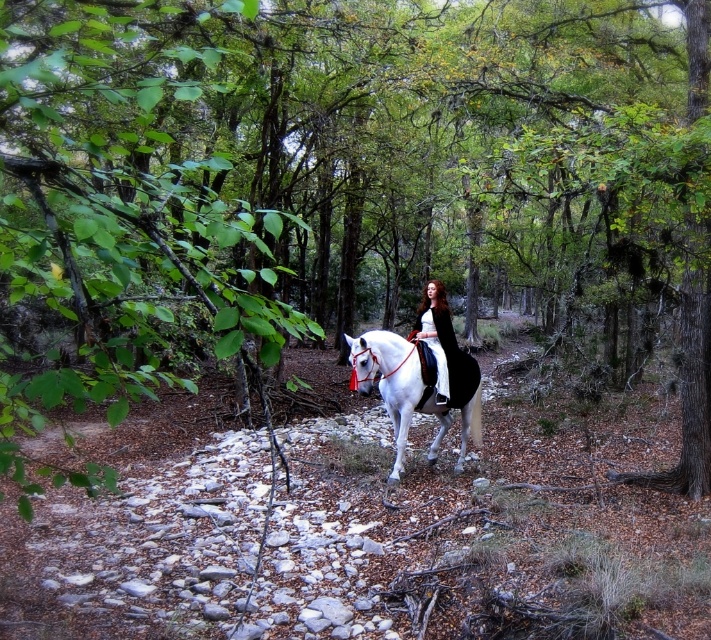
Is white glossy horse at center positioned in front of velvet black coat at center?

Yes, white glossy horse at center is in front of velvet black coat at center.

Who is lower down, white glossy horse at center or velvet black coat at center?

Positioned lower is white glossy horse at center.

The image size is (711, 640). What are the coordinates of `white glossy horse at center` in the screenshot? It's located at (x=387, y=380).